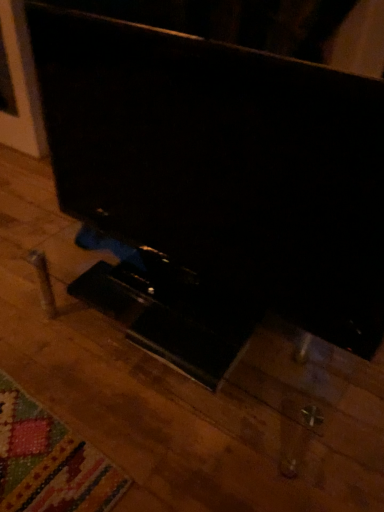
Find the location of a particular element. Image resolution: width=384 pixels, height=512 pixels. black glossy tv stand at center is located at coordinates (222, 165).

The height and width of the screenshot is (512, 384). What do you see at coordinates (222, 165) in the screenshot?
I see `black glossy tv stand at center` at bounding box center [222, 165].

Where is `black glossy tv stand at center`? The width and height of the screenshot is (384, 512). black glossy tv stand at center is located at coordinates (222, 165).